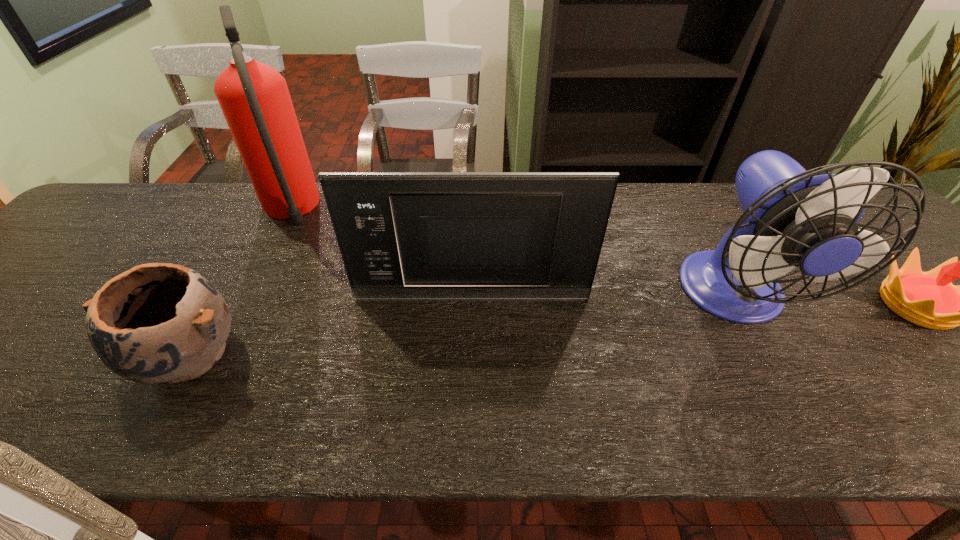
Select which object appears as the second closest to the shortest object. Please provide its 2D coordinates. Your answer should be formatted as a tuple, i.e. [(x, y)], where the tuple contains the x and y coordinates of a point satisfying the conditions above.

[(403, 236)]